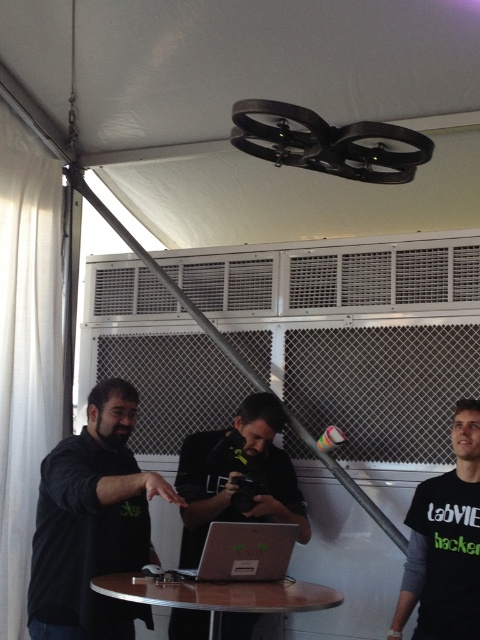
Consider the image. Which of these two, white fabric curtain at left or black matte shirt at lower right, stands shorter?

With less height is black matte shirt at lower right.

Can you confirm if white fabric curtain at left is shorter than black matte shirt at lower right?

No.

Locate an element on the screen. white fabric curtain at left is located at coordinates (25, 348).

Between point (64, 609) and point (151, 588), which one is positioned in front?

Point (151, 588) is more forward.

Who is more distant from viewer, (59, 544) or (164, 593)?

Point (59, 544)

At what (x,y) coordinates should I click in order to perform the action: click on black matte shirt at left. Please return your answer as a coordinate pair (x, y). This screenshot has height=640, width=480. Looking at the image, I should click on (93, 524).

Consider the image. Can you confirm if black matte shirt at left is bigger than black matte shirt at lower right?

Yes, black matte shirt at left is bigger than black matte shirt at lower right.

What do you see at coordinates (93, 524) in the screenshot?
I see `black matte shirt at left` at bounding box center [93, 524].

You are a GUI agent. You are given a task and a screenshot of the screen. Output one action in this format:
    pyautogui.click(x=<x>, y=<y>)
    Task: Click on the black matte shirt at left
    This screenshot has width=480, height=640.
    Given the screenshot: What is the action you would take?
    pyautogui.click(x=93, y=524)